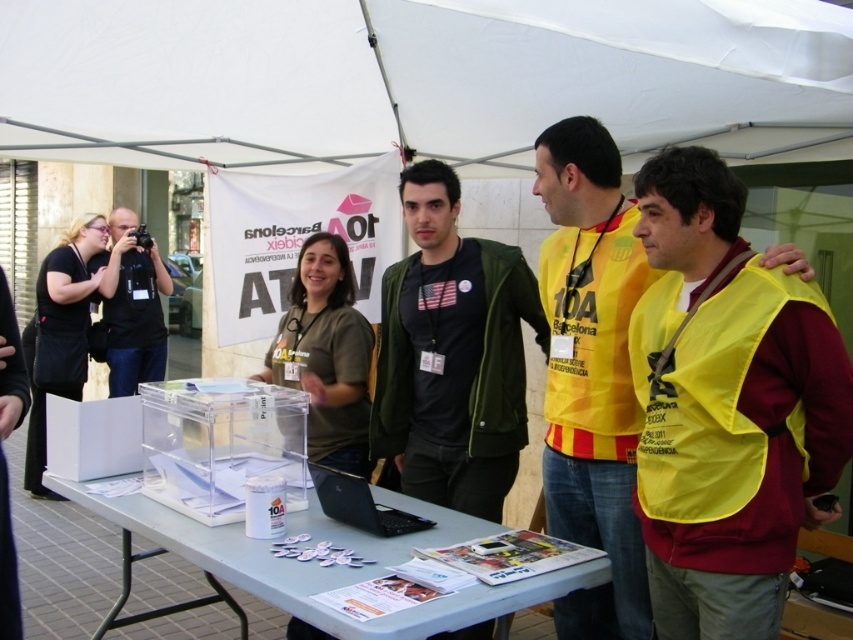
Which is below, dark green jacket at center or clear plastic table at center?

clear plastic table at center is lower down.

What do you see at coordinates (451, 355) in the screenshot?
I see `dark green jacket at center` at bounding box center [451, 355].

The image size is (853, 640). I want to click on dark green jacket at center, so click(451, 355).

Is dark green jacket at center taller than black matte laptop at center?

Yes, dark green jacket at center is taller than black matte laptop at center.

Who is positioned more to the right, dark green jacket at center or black matte laptop at center?

Positioned to the right is dark green jacket at center.

Which is behind, point (494, 397) or point (340, 481)?

Point (494, 397)

Where is `dark green jacket at center`? Image resolution: width=853 pixels, height=640 pixels. dark green jacket at center is located at coordinates (451, 355).

Does white fabric canopy at upper center have a greater height compared to clear plastic table at center?

Yes.

Which of these two, white fabric canopy at upper center or clear plastic table at center, stands shorter?

With less height is clear plastic table at center.

Between point (45, 61) and point (206, 554), which one is positioned behind?

The point (45, 61) is more distant.

Identify the location of white fabric canopy at upper center. (416, 80).